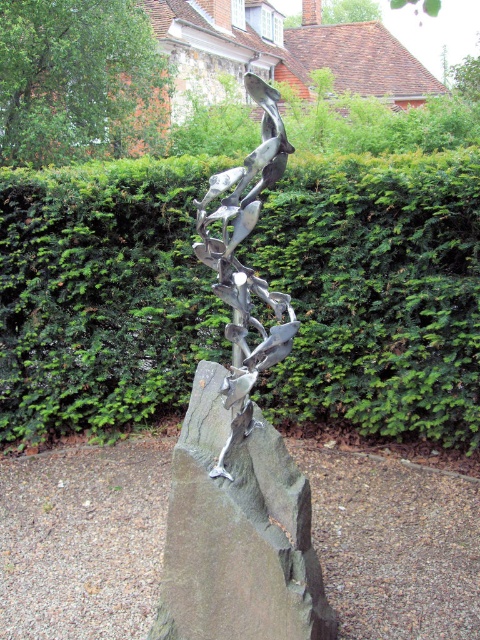
Question: Is green leafy hedge at center in front of polished gray rock at center?

Choices:
 (A) no
 (B) yes

Answer: (A)

Question: Which object is positioned farthest from the green leafy hedge at center?

Choices:
 (A) polished gray rock at center
 (B) polished bronze sculpture at center

Answer: (A)

Question: Is green leafy hedge at center positioned at the back of polished gray rock at center?

Choices:
 (A) yes
 (B) no

Answer: (A)

Question: Does polished gray rock at center have a smaller size compared to polished bronze sculpture at center?

Choices:
 (A) yes
 (B) no

Answer: (A)

Question: Estimate the real-world distances between objects in this image. Which object is farther from the green leafy hedge at center?

Choices:
 (A) polished gray rock at center
 (B) polished bronze sculpture at center

Answer: (A)

Question: Considering the real-world distances, which object is closest to the green leafy hedge at center?

Choices:
 (A) polished gray rock at center
 (B) polished bronze sculpture at center

Answer: (B)